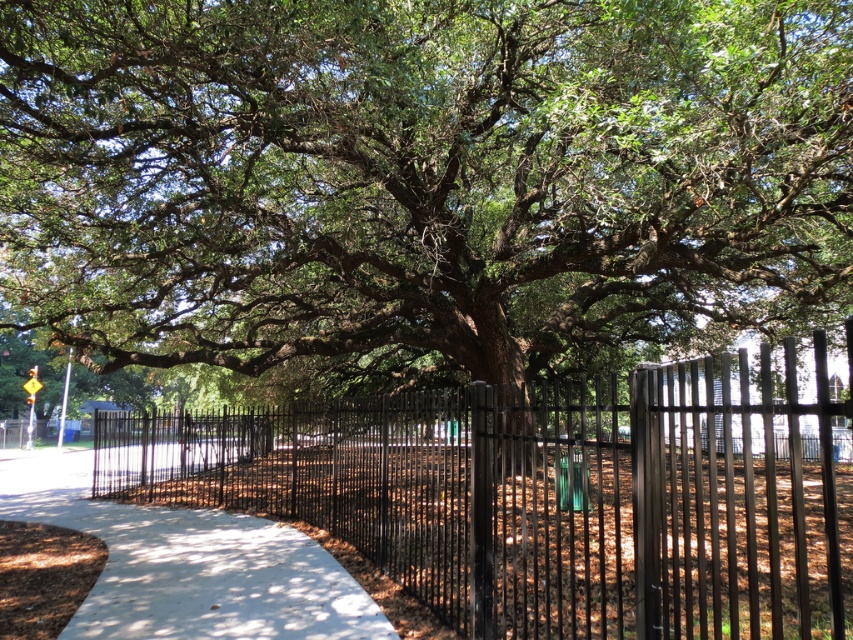
Question: Among these objects, which one is farthest from the camera?

Choices:
 (A) green leafy tree at center
 (B) black metal fence at center
 (C) white concrete pavement at center

Answer: (C)

Question: Which point is closer to the camera?

Choices:
 (A) pyautogui.click(x=270, y=488)
 (B) pyautogui.click(x=173, y=541)

Answer: (B)

Question: Is green leafy tree at center to the right of white concrete pavement at center from the viewer's perspective?

Choices:
 (A) no
 (B) yes

Answer: (B)

Question: Is the position of green leafy tree at center less distant than that of white concrete pavement at center?

Choices:
 (A) no
 (B) yes

Answer: (B)

Question: Is black metal fence at center smaller than white concrete pavement at center?

Choices:
 (A) no
 (B) yes

Answer: (A)

Question: Among these objects, which one is nearest to the camera?

Choices:
 (A) white concrete pavement at center
 (B) black metal fence at center
 (C) green leafy tree at center

Answer: (B)